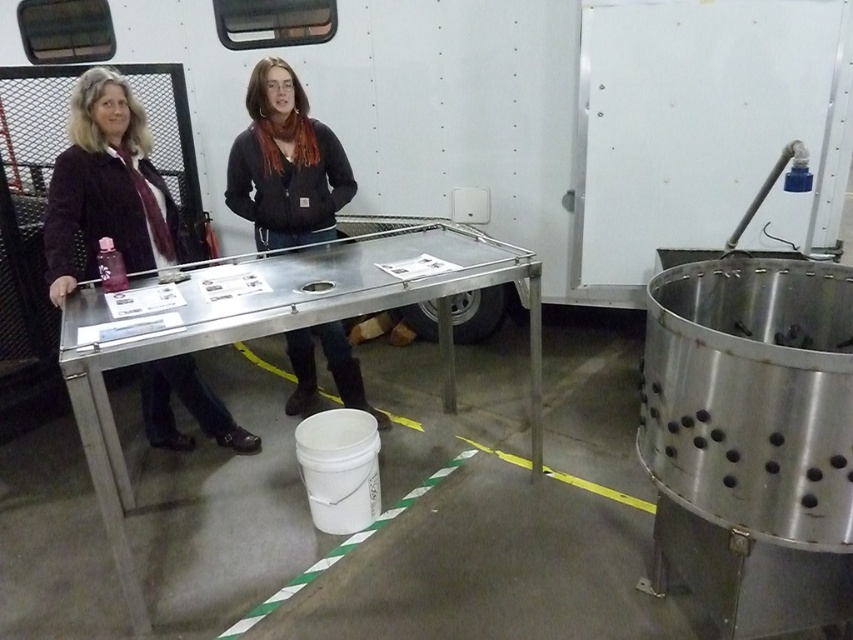
Question: Can you confirm if matte black jacket at left is positioned to the right of matte black jacket at center?

Choices:
 (A) no
 (B) yes

Answer: (A)

Question: Can you confirm if matte black jacket at left is wider than matte black jacket at center?

Choices:
 (A) yes
 (B) no

Answer: (B)

Question: Which point is closer to the camera?

Choices:
 (A) matte black jacket at left
 (B) matte black jacket at center

Answer: (A)

Question: Which point appears farthest from the camera in this image?

Choices:
 (A) (90, 276)
 (B) (276, 196)

Answer: (B)

Question: From the image, what is the correct spatial relationship of matte black jacket at left in relation to matte black jacket at center?

Choices:
 (A) above
 (B) below

Answer: (B)